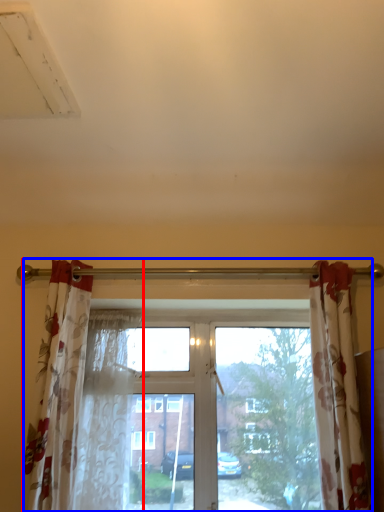
Question: Among these objects, which one is nearest to the camera, curtain (highlighted by a red box) or window (highlighted by a blue box)?

Choices:
 (A) curtain
 (B) window

Answer: (A)